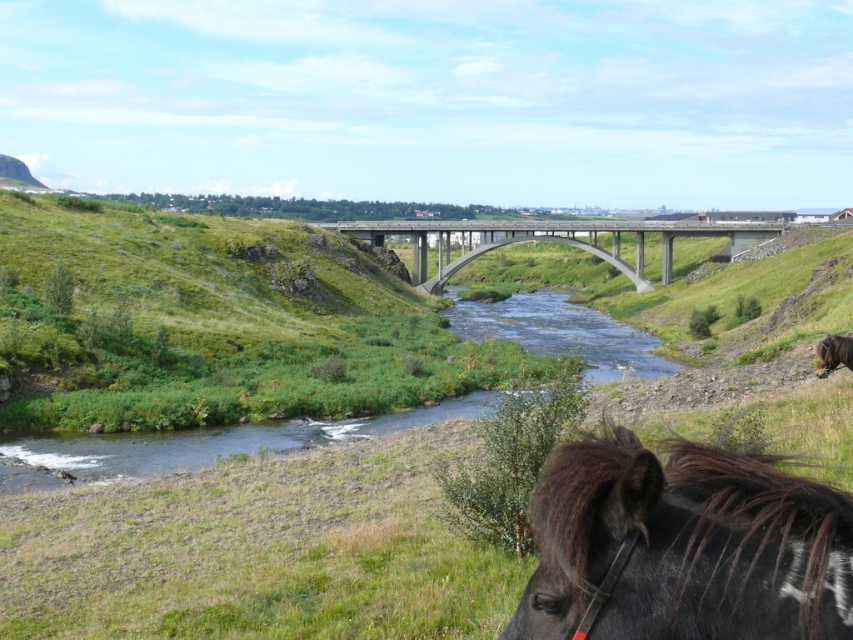
You are a delivery truck driver who needs to cross the river using the bridge. Your truck is 14 feet wide. Can you safely drive through the gap between the green grassy at center and the concrete bridge at center?

The gap between the green grassy at center and the concrete bridge at center is 148.30 feet. Since your truck is only 14 feet wide, there is ample space for it to pass safely through the gap without any issues.